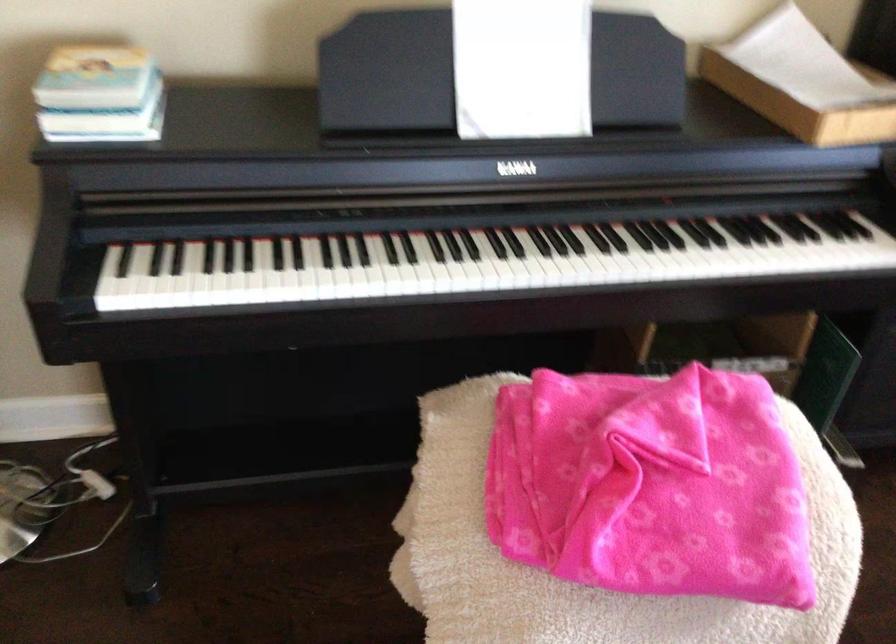
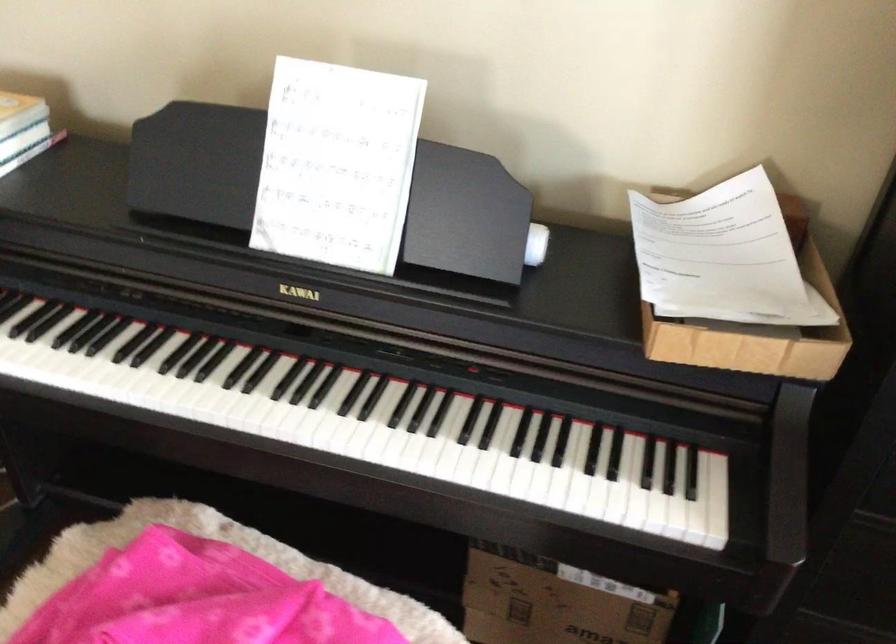
The point at (357, 276) is marked in the first image. Where is the corresponding point in the second image?

(58, 368)